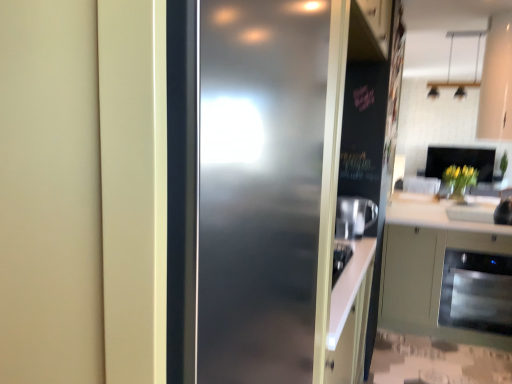
Question: Is matte green cabinet at lower right inside the boundaries of white glossy sink at lower right, or outside?

Choices:
 (A) outside
 (B) inside

Answer: (A)

Question: From a real-world perspective, is matte green cabinet at lower right physically located above or below white glossy sink at lower right?

Choices:
 (A) below
 (B) above

Answer: (A)

Question: Estimate the real-world distances between objects in this image. Which object is farther from the matte green cabinet at lower right?

Choices:
 (A) white glossy sink at lower right
 (B) sleek stainless steel dishwasher at lower right
 (C) yellow matte vase at right
 (D) translucent glass vase at center
 (E) matte white door at center

Answer: (C)

Question: Estimate the real-world distances between objects in this image. Which object is closer to the sleek stainless steel dishwasher at lower right?

Choices:
 (A) translucent glass vase at center
 (B) matte green cabinet at lower right
 (C) white glossy sink at lower right
 (D) matte white door at center
 (E) yellow matte vase at right

Answer: (B)